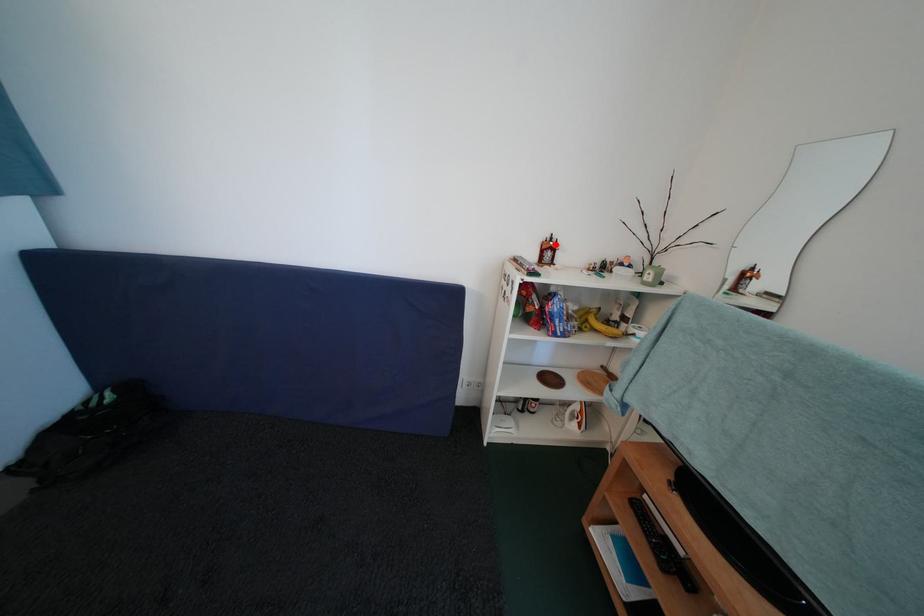
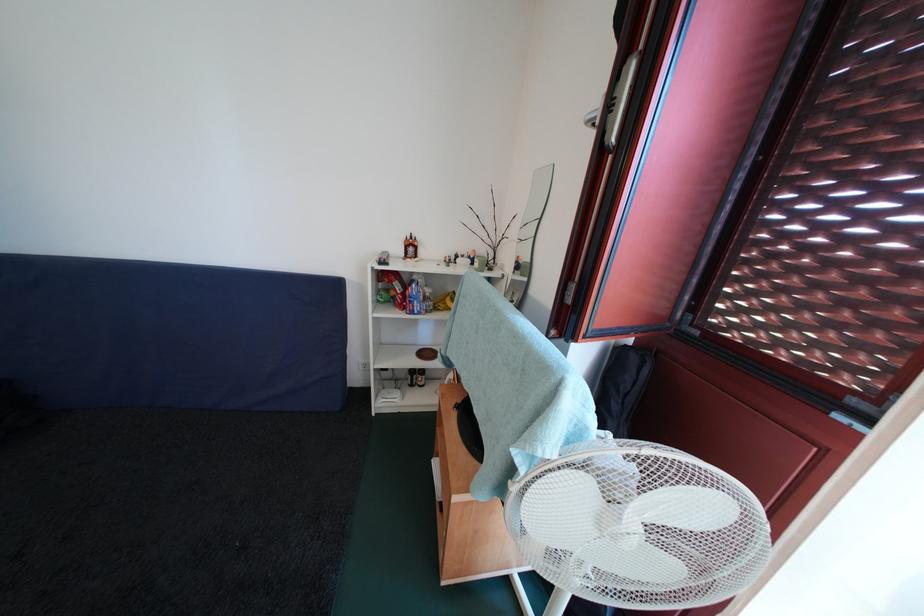
Where in the second image is the point corresponding to the highlighted location from the first image?

(416, 243)